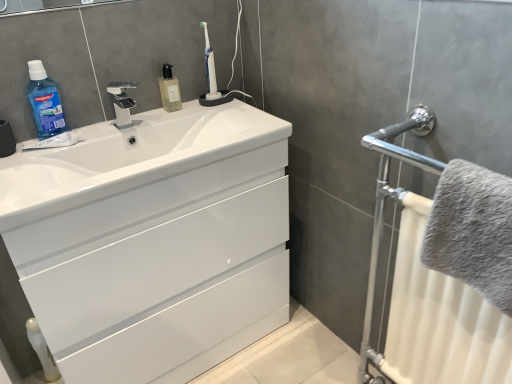
Question: Does gray fluffy towel at right come in front of blue translucent liquid at upper left?

Choices:
 (A) yes
 (B) no

Answer: (A)

Question: Considering the relative sizes of gray fluffy towel at right and blue translucent liquid at upper left in the image provided, is gray fluffy towel at right shorter than blue translucent liquid at upper left?

Choices:
 (A) no
 (B) yes

Answer: (A)

Question: From the image's perspective, is gray fluffy towel at right beneath blue translucent liquid at upper left?

Choices:
 (A) no
 (B) yes

Answer: (B)

Question: Is gray fluffy towel at right wider than blue translucent liquid at upper left?

Choices:
 (A) no
 (B) yes

Answer: (B)

Question: Is gray fluffy towel at right not close to blue translucent liquid at upper left?

Choices:
 (A) yes
 (B) no

Answer: (A)

Question: Looking at their shapes, would you say polished chrome tap at upper center is wider or thinner than white glossy cabinet at center?

Choices:
 (A) wide
 (B) thin

Answer: (B)

Question: From a real-world perspective, is polished chrome tap at upper center positioned above or below white glossy cabinet at center?

Choices:
 (A) above
 (B) below

Answer: (A)

Question: Based on their positions, is polished chrome tap at upper center located to the left or right of white glossy cabinet at center?

Choices:
 (A) left
 (B) right

Answer: (A)

Question: Does point (119, 125) appear closer or farther from the camera than point (80, 331)?

Choices:
 (A) closer
 (B) farther

Answer: (B)

Question: Looking at their shapes, would you say polished chrome tap at upper center is wider or thinner than white glossy sink at center?

Choices:
 (A) wide
 (B) thin

Answer: (B)

Question: Does point (121, 107) appear closer or farther from the camera than point (147, 117)?

Choices:
 (A) farther
 (B) closer

Answer: (B)

Question: In the image, is polished chrome tap at upper center positioned in front of or behind white glossy sink at center?

Choices:
 (A) front
 (B) behind

Answer: (B)

Question: In terms of size, does polished chrome tap at upper center appear bigger or smaller than white glossy sink at center?

Choices:
 (A) small
 (B) big

Answer: (A)

Question: Is gray fluffy towel at right in front of or behind blue translucent liquid at upper left in the image?

Choices:
 (A) front
 (B) behind

Answer: (A)

Question: Is gray fluffy towel at right inside or outside of blue translucent liquid at upper left?

Choices:
 (A) inside
 (B) outside

Answer: (B)